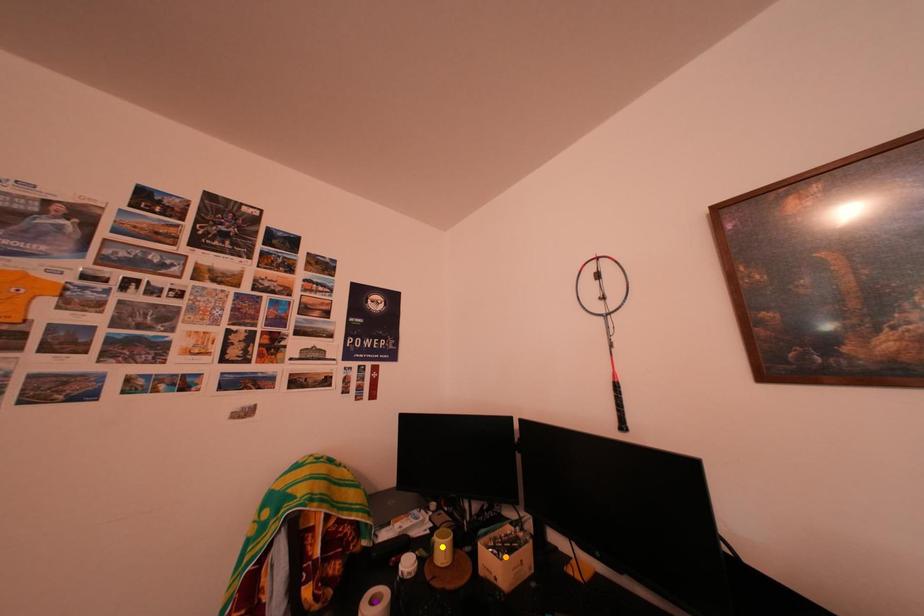
Order these from nearest to farthest:
yellow point, orange point, purple point

purple point, orange point, yellow point